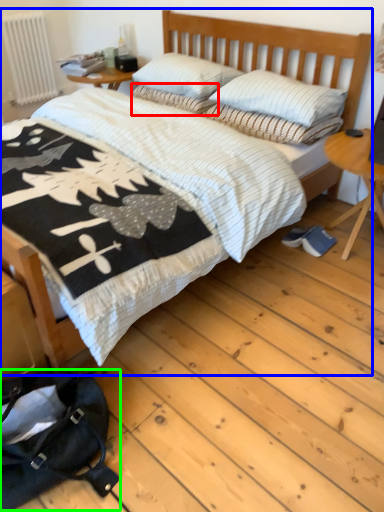
Question: Which object is the farthest from pillow (highlighted by a red box)? Choose among these: bed (highlighted by a blue box) or messenger bag (highlighted by a green box).

Choices:
 (A) bed
 (B) messenger bag

Answer: (B)